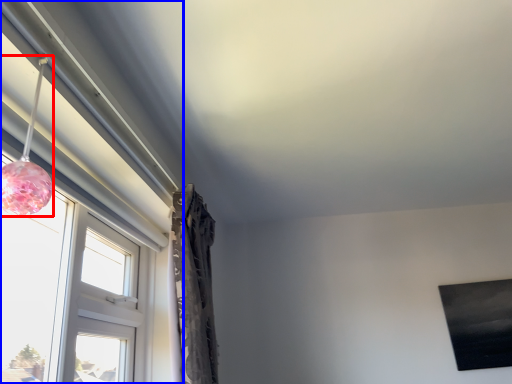
Question: Which point is closer to the camera, lamp (highlighted by a red box) or window (highlighted by a blue box)?

Choices:
 (A) lamp
 (B) window

Answer: (A)